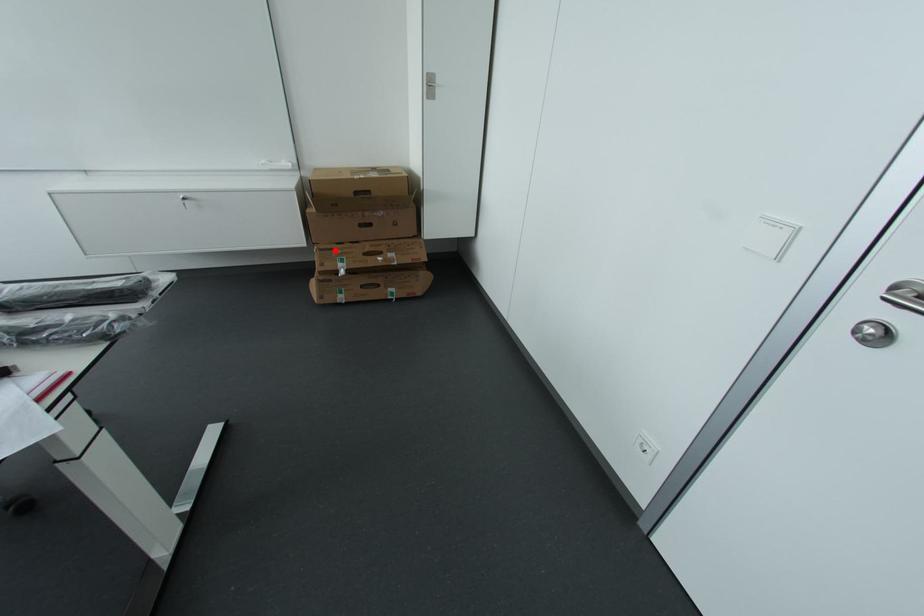
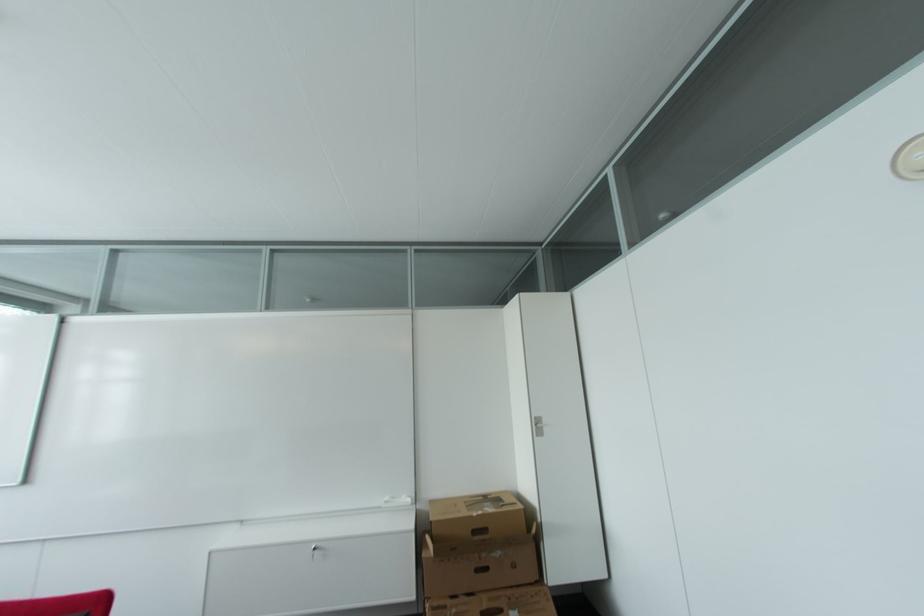
Question: A red point is marked in image1. In image2, is the corresponding 3D point closer to the camera or farther? Reply with the corresponding letter.

Choices:
 (A) The corresponding 3D point is closer.
 (B) The corresponding 3D point is farther.

Answer: (B)